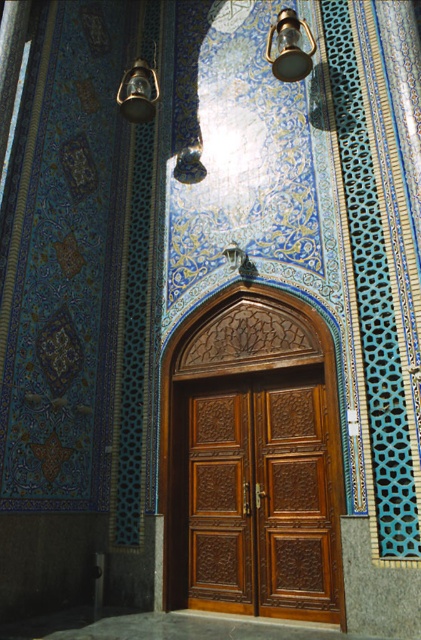
Which is above, brown carved wood door at center or metallic glass at upper center?

Positioned higher is metallic glass at upper center.

Between brown carved wood door at center and metallic glass at upper center, which one is positioned lower?

brown carved wood door at center

Is point (199, 477) closer to camera compared to point (292, 65)?

That is False.

Identify the location of brown carved wood door at center. The height and width of the screenshot is (640, 421). (x=261, y=496).

Does brown carved wood door at center have a greater width compared to metallic brass lantern at upper left?

Yes.

Which is behind, point (271, 456) or point (125, 112)?

The point (125, 112) is behind.

Who is more distant from viewer, (317,612) or (151,74)?

Positioned behind is point (151,74).

Identify the location of brown carved wood door at center. The width and height of the screenshot is (421, 640). (261, 496).

Consider the image. Can you confirm if metallic glass at upper center is shorter than metallic brass lantern at upper left?

No, metallic glass at upper center is not shorter than metallic brass lantern at upper left.

Who is more distant from viewer, (301, 52) or (122, 99)?

The point (122, 99) is behind.

You are a GUI agent. You are given a task and a screenshot of the screen. Output one action in this format:
    pyautogui.click(x=<x>, y=<y>)
    Task: Click on the metallic glass at upper center
    This screenshot has height=640, width=421.
    Given the screenshot: What is the action you would take?
    pyautogui.click(x=290, y=48)